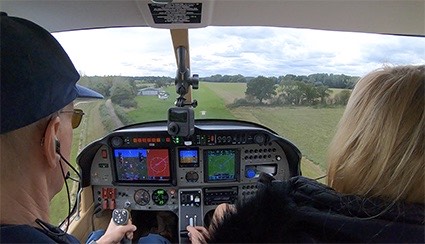
What are the coordinates of `web cam` in the screenshot? It's located at (184, 122).